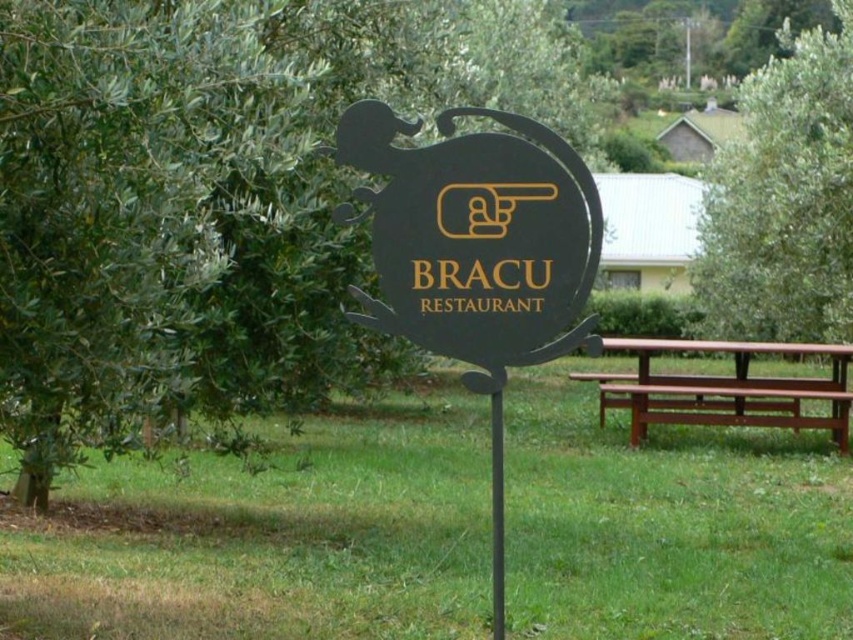
Question: Which object appears closest to the camera in this image?

Choices:
 (A) green grass at center
 (B) green leafy tree at center
 (C) black matte sign at center

Answer: (B)

Question: Which of these objects is positioned farthest from the brown wooden picnic table at right?

Choices:
 (A) black matte sign at center
 (B) green leafy tree at center

Answer: (A)

Question: Considering the real-world distances, which object is farthest from the green leafy tree at right?

Choices:
 (A) green grass at center
 (B) green leafy tree at center
 (C) brown wooden picnic table at right
 (D) black matte sign at center

Answer: (D)

Question: From the image, what is the correct spatial relationship of green grass at center in relation to green leafy tree at right?

Choices:
 (A) left
 (B) right

Answer: (A)

Question: Does green leafy tree at right lie in front of brown wooden picnic table at right?

Choices:
 (A) no
 (B) yes

Answer: (A)

Question: Is green leafy tree at center smaller than green leafy tree at right?

Choices:
 (A) no
 (B) yes

Answer: (B)